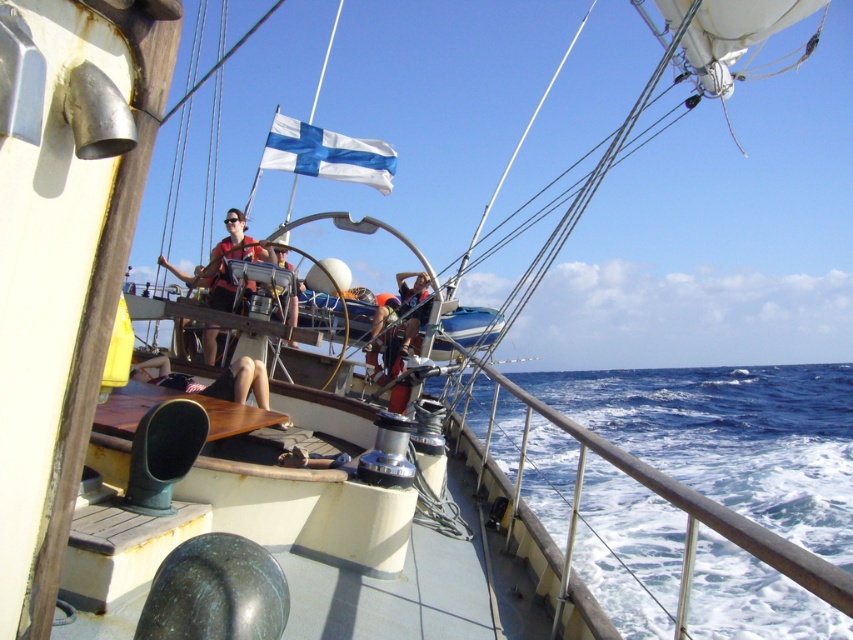
Question: Does matte black helmet at center have a greater width compared to matte gray shirt at center?

Choices:
 (A) yes
 (B) no

Answer: (A)

Question: Is wooden at center smaller than tan leather shorts at center?

Choices:
 (A) yes
 (B) no

Answer: (B)

Question: Is tan leather shorts at center thinner than matte black helmet at center?

Choices:
 (A) no
 (B) yes

Answer: (A)

Question: Which point is farther to the camera?

Choices:
 (A) (418, 310)
 (B) (270, 420)
 (C) (387, 294)

Answer: (C)

Question: Among these points, which one is farthest from the camera?

Choices:
 (A) (381, 296)
 (B) (409, 316)
 (C) (321, 150)

Answer: (A)

Question: Which is farther from the matte gray shirt at center?

Choices:
 (A) matte black helmet at center
 (B) blue water at lower right
 (C) tan leather shorts at center

Answer: (B)